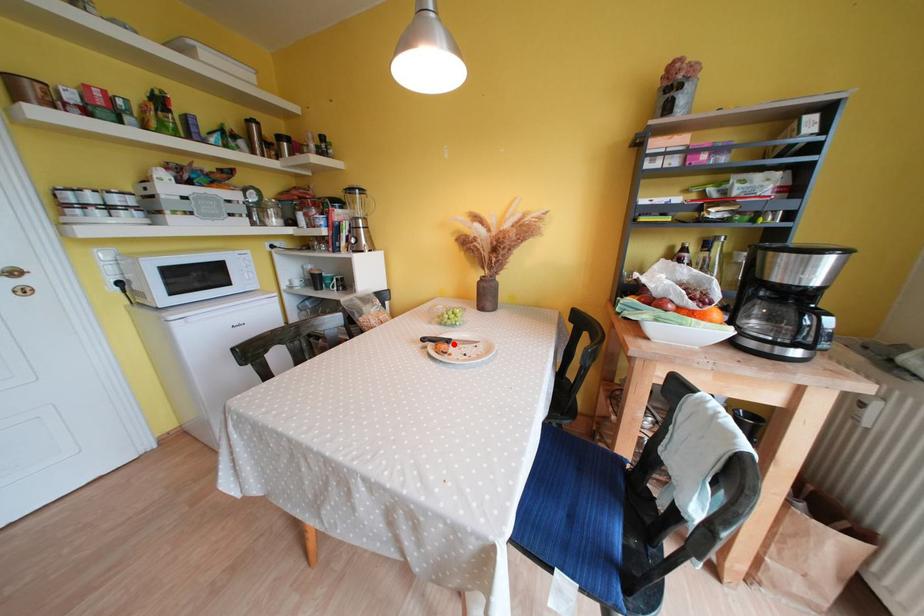
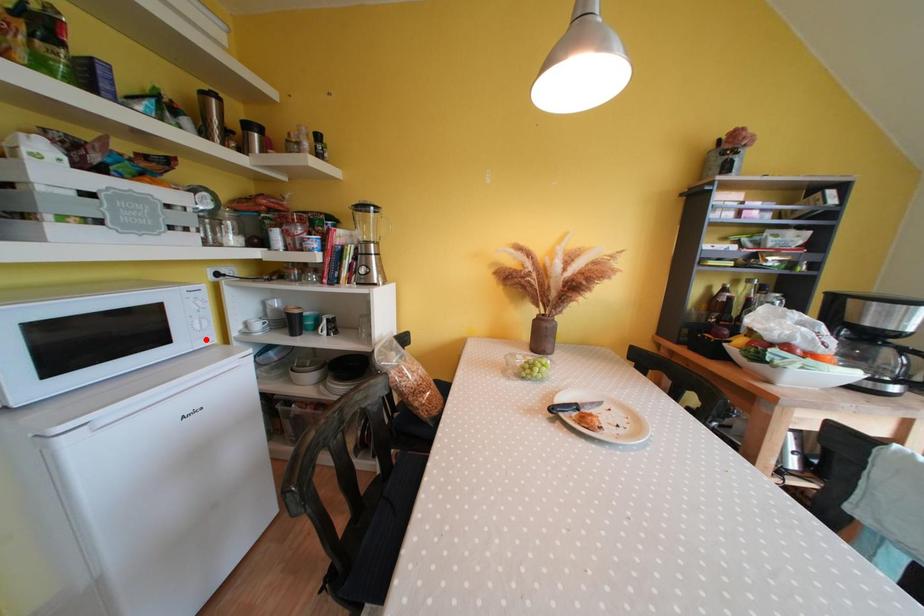
I am providing you with two images of the same scene from different viewpoints. A red point is marked on the first image and another point is marked on the second image. Do the highlighted points in image1 and image2 indicate the same real-world spot?

No